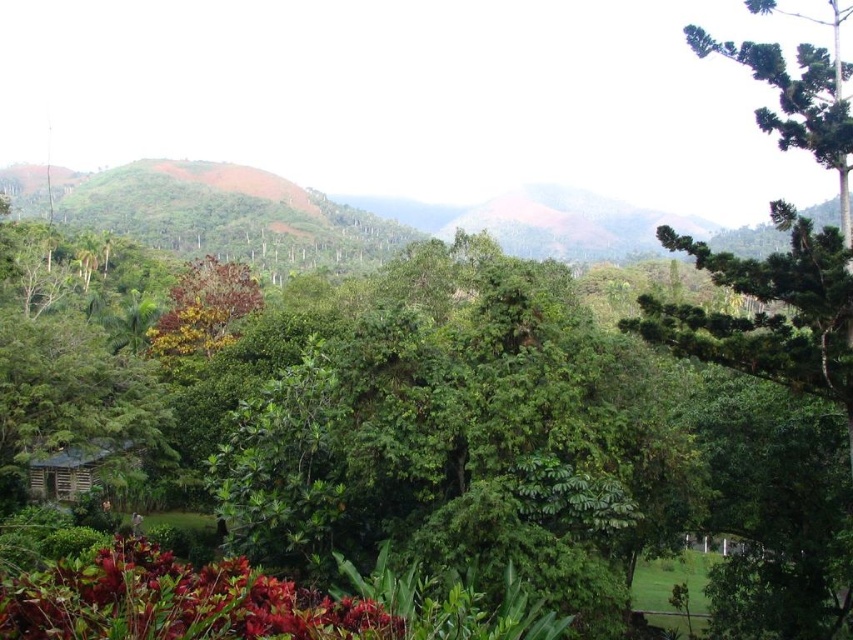
You are planning to plant a new tree in your garden. You have two options based on the image you see. The green leafy tree at center and the shiny red leaves at bottom left. Which one would take up more space in your garden?

The green leafy tree at center is bigger than the shiny red leaves at bottom left, so it would take up more space in your garden.

You are standing in the lush landscape and want to place a small garden ornament between the green leafy tree at center and the shiny red leaves at bottom left. Based on their positions, where should you place it so it is equidistant from both?

Since the green leafy tree at center is positioned over the shiny red leaves at bottom left, placing the ornament directly below the green leafy tree at center and above the shiny red leaves at bottom left would ensure it is equidistant from both.

You are standing in the lush landscape and want to determine the relative positions of two points marked in the scene. Which point, point (407, 499) or point (49, 609), is closer to you?

Point (407, 499) is closer to you because it is further to the viewer than point (49, 609).